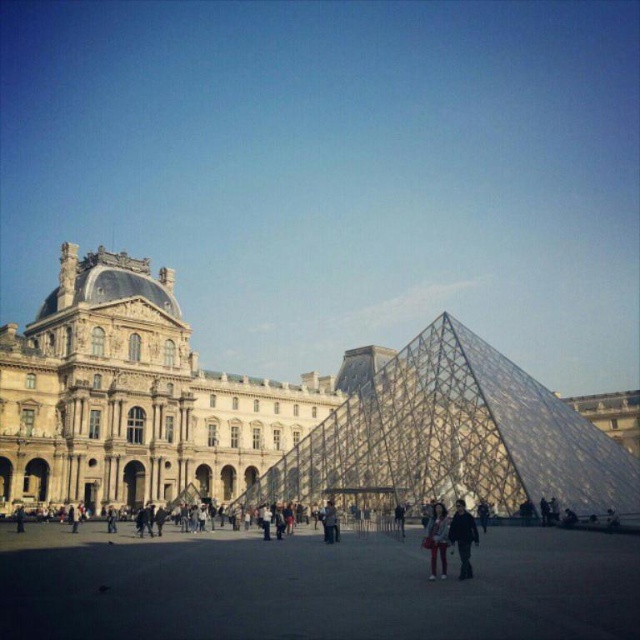
Image resolution: width=640 pixels, height=640 pixels. Find the location of `golden stone palace at center`. golden stone palace at center is located at coordinates (273, 412).

Is golden stone palace at center positioned before dark gray jacket at lower left?

No, it is behind dark gray jacket at lower left.

Between point (83, 408) and point (16, 509), which one is positioned behind?

The point (83, 408) is more distant.

Identify the location of golden stone palace at center. (273, 412).

Which of these two, golden stone palace at center or dark gray concrete plaza at center, stands shorter?

dark gray concrete plaza at center is shorter.

Does point (288, 417) come in front of point (228, 570)?

No, (288, 417) is behind (228, 570).

The height and width of the screenshot is (640, 640). Find the location of `golden stone palace at center`. golden stone palace at center is located at coordinates (273, 412).

Between light brown leather jacket at center and dark gray jacket at lower left, which one has more height?

With more height is light brown leather jacket at center.

Describe the element at coordinates (330, 522) in the screenshot. This screenshot has height=640, width=640. I see `light brown leather jacket at center` at that location.

Identify the location of light brown leather jacket at center. (330, 522).